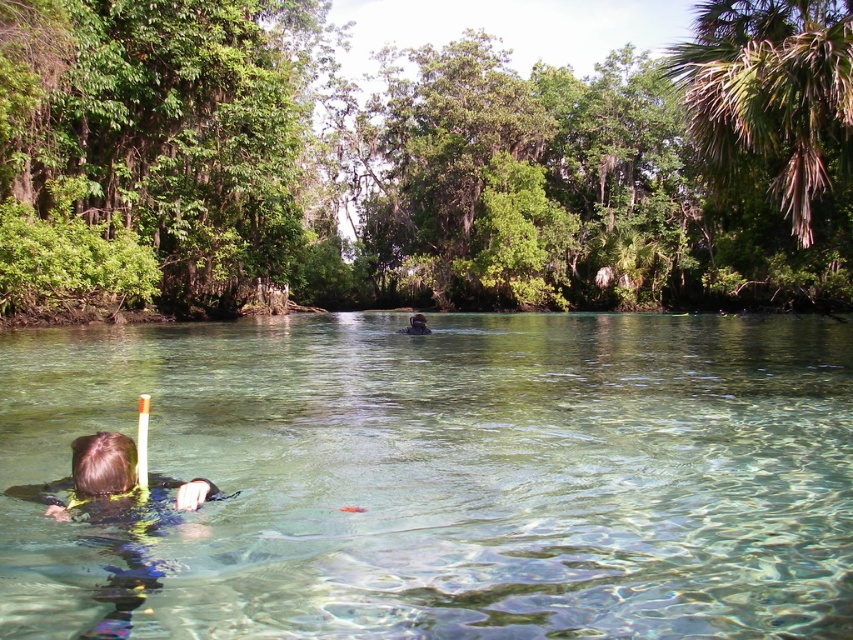
You are a snorkeler trying to locate two points in the water. The first point is at coordinate point (460, 513) and the second is at point (108, 460). Which point is closer to you?

Point (460, 513) is closer to you because it is further to the viewer than point (108, 460).

You are planning to take a photo of the blue neoprene snorkeler at lower left and the black rubber snorkel at center. Which object should you zoom in on to capture more details without moving the camera?

The blue neoprene snorkeler at lower left should be zoomed in on because it is smaller in size compared to the black rubber snorkel at center, so zooming in on it would allow capturing more details without moving the camera.